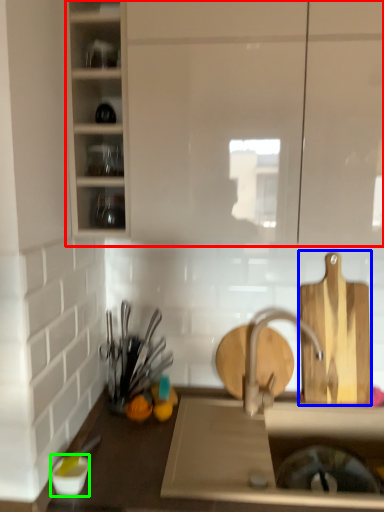
Question: Based on their relative distances, which object is nearer to cabinetry (highlighted by a red box)? Choose from cutting board (highlighted by a blue box) and tableware (highlighted by a green box).

Choices:
 (A) cutting board
 (B) tableware

Answer: (A)